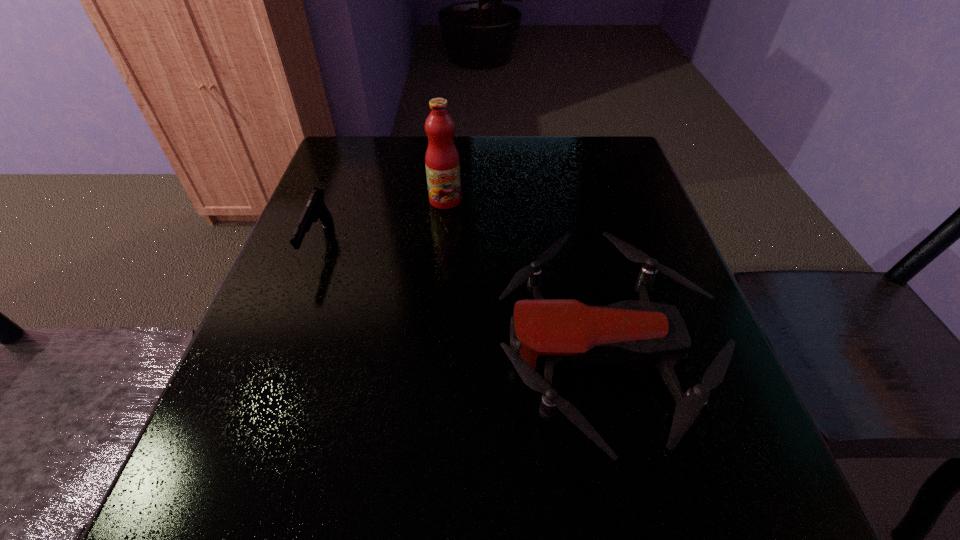
At what (x,y) coordinates should I click in order to perform the action: click on object that is at the left edge. Please return your answer as a coordinate pair (x, y). The width and height of the screenshot is (960, 540). Looking at the image, I should click on (315, 209).

Where is `object present at the right edge`? The height and width of the screenshot is (540, 960). object present at the right edge is located at coordinates (x=555, y=334).

Locate an element on the screen. The image size is (960, 540). object present at the near right corner is located at coordinates (555, 334).

The image size is (960, 540). In the image, there is a desktop. Find the location of `vacant space at the far edge`. vacant space at the far edge is located at coordinates (423, 171).

Locate an element on the screen. blank space at the near edge of the desktop is located at coordinates (527, 519).

The image size is (960, 540). I want to click on free point at the left edge, so click(x=351, y=291).

In order to click on free space at the right edge of the desktop in this screenshot , I will do `click(652, 447)`.

At what (x,y) coordinates should I click in order to perform the action: click on vacant space at the far left corner of the desktop. Please return your answer as a coordinate pair (x, y). This screenshot has height=540, width=960. Looking at the image, I should click on (347, 145).

Find the location of `vacant region at the near left corner of the desktop`. vacant region at the near left corner of the desktop is located at coordinates (180, 487).

Image resolution: width=960 pixels, height=540 pixels. I want to click on free space at the far right corner of the desktop, so click(x=570, y=139).